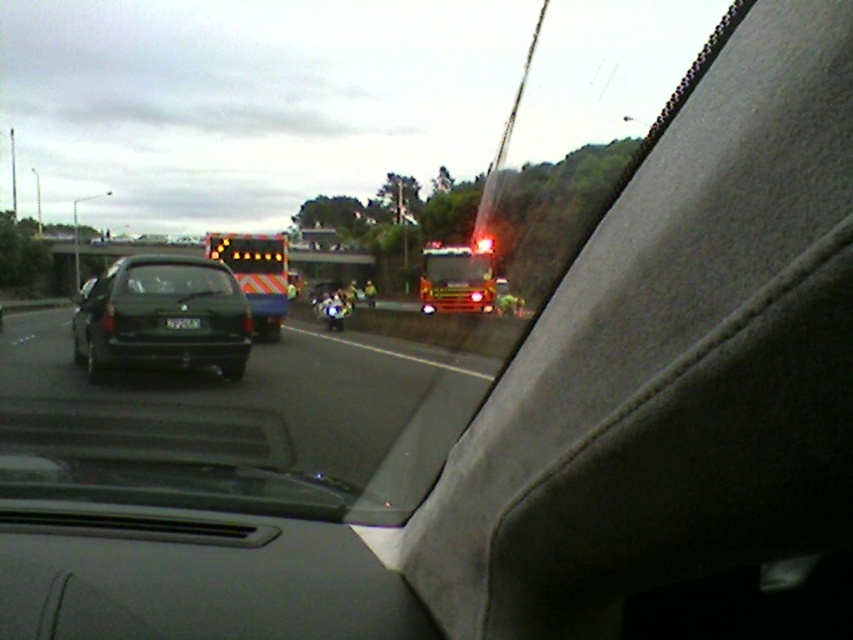
Does matte black hatchback at center have a greater height compared to black plastic license plate at center?

Correct, matte black hatchback at center is much taller as black plastic license plate at center.

Who is positioned more to the left, matte black hatchback at center or black plastic license plate at center?

Positioned to the left is matte black hatchback at center.

What do you see at coordinates (161, 317) in the screenshot? I see `matte black hatchback at center` at bounding box center [161, 317].

You are a GUI agent. You are given a task and a screenshot of the screen. Output one action in this format:
    pyautogui.click(x=<x>, y=<y>)
    Task: Click on the matte black hatchback at center
    This screenshot has width=853, height=640.
    Given the screenshot: What is the action you would take?
    pyautogui.click(x=161, y=317)

Which is more to the right, black glossy car at left or matte black hatchback at center?

Positioned to the right is black glossy car at left.

This screenshot has height=640, width=853. Describe the element at coordinates (248, 412) in the screenshot. I see `black glossy car at left` at that location.

What do you see at coordinates (248, 412) in the screenshot? I see `black glossy car at left` at bounding box center [248, 412].

This screenshot has height=640, width=853. I want to click on black glossy car at left, so point(248,412).

Who is positioned more to the right, shiny red fire truck at center or black matte windshield at center?

From the viewer's perspective, shiny red fire truck at center appears more on the right side.

Is shiny red fire truck at center positioned behind black matte windshield at center?

Yes, shiny red fire truck at center is behind black matte windshield at center.

The height and width of the screenshot is (640, 853). Describe the element at coordinates (457, 276) in the screenshot. I see `shiny red fire truck at center` at that location.

Find the location of `shiny red fire truck at center`. shiny red fire truck at center is located at coordinates (457, 276).